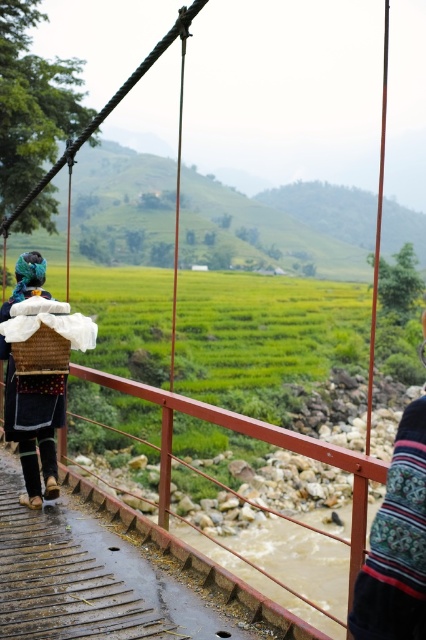
You are a traveler on the suspension bridge and notice two baskets on the left side of the bridge. Which basket is more to the left, the dark blue woven basket at left or the rustic woven basket at left?

The dark blue woven basket at left is more to the left because it is positioned on the left side of the rustic woven basket at left.

You are standing at the point with coordinates (34, 424) in the image. Looking around, you see the dark blue woven basket at left. What object is located at your current position?

The point at coordinates (34, 424) corresponds to the dark blue woven basket at left.

You are a traveler who wants to take a photo of the striped fabric shawl at center and the rustic woven basket at left. Since you want both items to appear equally prominent in the photo, which one should you zoom in on more?

The striped fabric shawl at center is larger in size compared to the rustic woven basket at left, so you should zoom in more on the rustic woven basket at left to make both appear equally prominent in the photo.